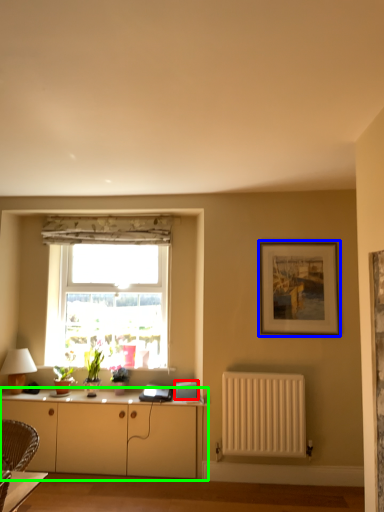
Question: Based on their relative distances, which object is farther from appliance (highlighted by a red box)? Choose from picture frame (highlighted by a blue box) and cabinetry (highlighted by a green box).

Choices:
 (A) picture frame
 (B) cabinetry

Answer: (A)